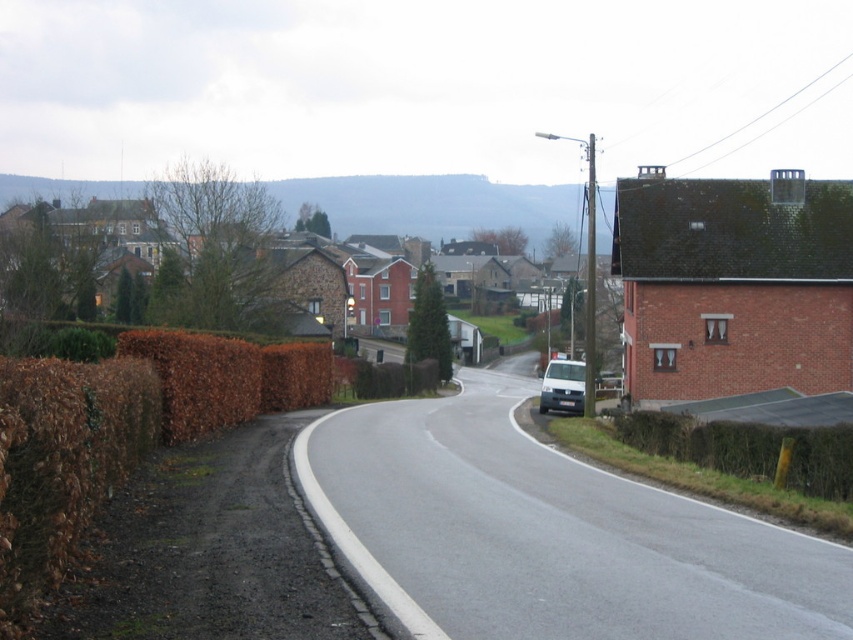
Does asphalt road at center have a greater width compared to brown textured hedge at right?

Indeed, asphalt road at center has a greater width compared to brown textured hedge at right.

Is asphalt road at center above brown textured hedge at right?

No.

Between point (500, 586) and point (764, 476), which one is positioned behind?

The point (764, 476) is more distant.

This screenshot has width=853, height=640. In order to click on asphalt road at center in this screenshot , I will do 544,534.

Is brown textured hedge at right wider than white matte van at center?

No.

Is point (817, 490) more distant than point (563, 378)?

That is False.

Is point (722, 435) positioned in front of point (556, 396)?

Yes, point (722, 435) is closer to viewer.

Find the location of `brown textured hedge at right`. brown textured hedge at right is located at coordinates (746, 449).

Does asphalt road at center appear over white matte van at center?

Yes, asphalt road at center is above white matte van at center.

Is point (416, 403) farther from viewer compared to point (547, 396)?

Yes, point (416, 403) is behind point (547, 396).

Is point (403, 554) closer to camera compared to point (572, 401)?

Yes, point (403, 554) is in front of point (572, 401).

Identify the location of asphalt road at center. (544, 534).